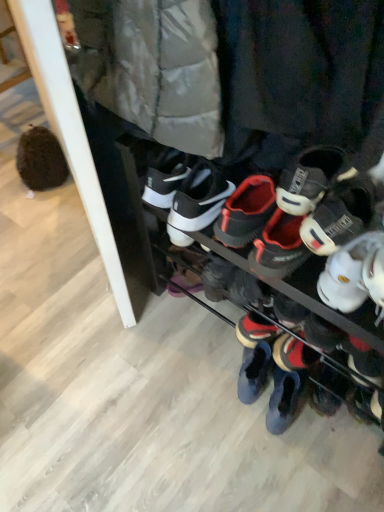
Question: Is black matte sneakers at center, the first footwear in the front-to-back sequence, inside or outside of black suede sneaker at lower right, the third footwear from the front?

Choices:
 (A) inside
 (B) outside

Answer: (B)

Question: Is black matte sneakers at center, which is counted as the third footwear, starting from the back, wider or thinner than black suede sneaker at lower right, which is the first footwear in back-to-front order?

Choices:
 (A) thin
 (B) wide

Answer: (B)

Question: Based on their relative distances, which object is farther from the black suede sneaker at lower right, which is the first footwear in back-to-front order?

Choices:
 (A) black matte sneakers at center, the first footwear in the front-to-back sequence
 (B) white matte sneaker at right, acting as the second footwear starting from the back

Answer: (B)

Question: Considering the real-world distances, which object is farthest from the black matte sneakers at center, which is counted as the third footwear, starting from the back?

Choices:
 (A) white matte sneaker at right, acting as the second footwear starting from the back
 (B) black suede sneaker at lower right, which is the first footwear in back-to-front order

Answer: (B)